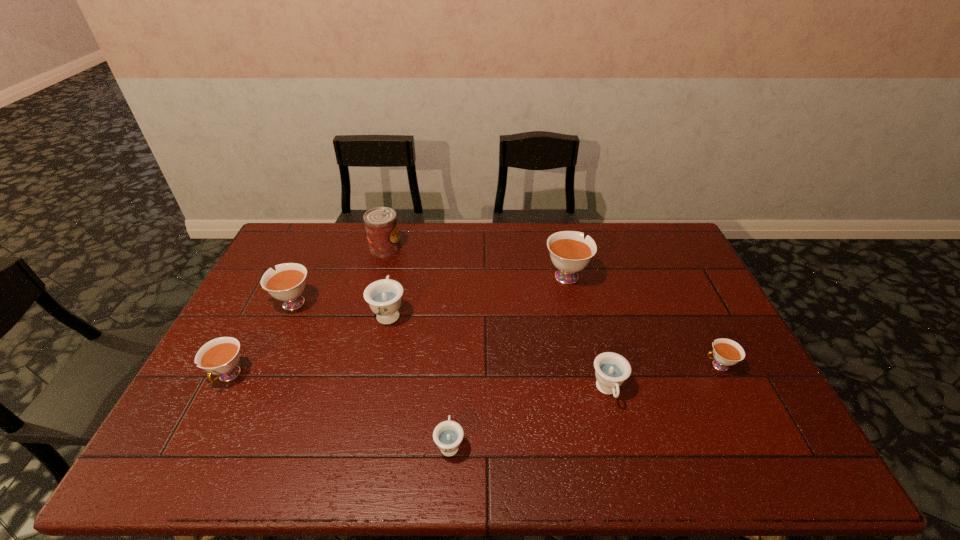
Image resolution: width=960 pixels, height=540 pixels. Identify the location of vacant area that lies between the farthest object and the third biggest white teacup. (307, 312).

Find the location of a particular element. The width and height of the screenshot is (960, 540). vacant area that lies between the third biggest white teacup and the tallest teacup is located at coordinates (397, 325).

Locate an element on the screen. Image resolution: width=960 pixels, height=540 pixels. empty location between the biggest white teacup and the second smallest white teacup is located at coordinates (397, 325).

What are the coordinates of `empty space that is in between the second biggest white teacup and the second farthest blue teacup` in the screenshot? It's located at (449, 347).

Find the location of a particular element. vacant area that lies between the second smallest white teacup and the rightmost white teacup is located at coordinates (473, 370).

Locate an element on the screen. This screenshot has height=540, width=960. vacant area that lies between the second nearest blue teacup and the smallest blue teacup is located at coordinates (529, 417).

The width and height of the screenshot is (960, 540). I want to click on object that ranks as the seventh closest to the second nearest blue teacup, so click(220, 356).

Find the location of `object identified as the sixth closest to the third teacup from left to right`. object identified as the sixth closest to the third teacup from left to right is located at coordinates (611, 369).

The height and width of the screenshot is (540, 960). I want to click on teacup that is the fourth closest to the second biggest white teacup, so click(570, 253).

Where is `teacup that is the fifth closest to the second smallest blue teacup`? The height and width of the screenshot is (540, 960). teacup that is the fifth closest to the second smallest blue teacup is located at coordinates (287, 283).